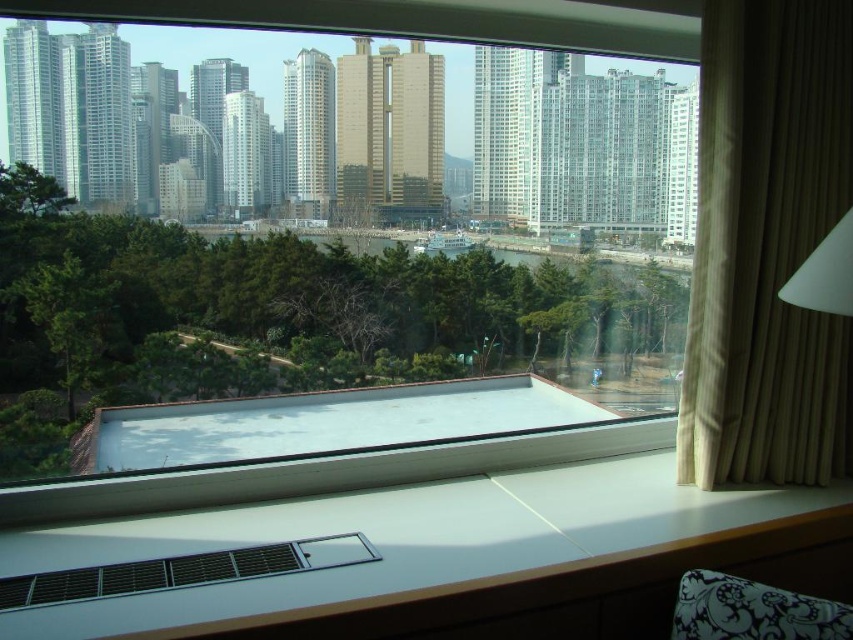
You are standing inside the room and want to look out through the transparent glass window at center. Where should you position yourself to see the entire cityscape outside?

Position yourself at the center of the room to ensure you can see the entire cityscape through the transparent glass window at center located at point coordinates (318,224).

You are standing inside the room and want to look outside through the transparent glass window at center. However, the matte plastic vent at lower center is blocking your view. Can you see the cityscape through the window without moving the vent?

The transparent glass window at center is bigger than the matte plastic vent at lower center, so yes, you can still see the cityscape through the transparent glass window at center as it is larger and not fully obstructed by the vent.

You are standing in the room looking out the window. You notice a matte plastic vent at lower center and a white matte lampshade at upper right. Which object is positioned to the left of the other?

The matte plastic vent at lower center is to the left of the white matte lampshade at upper right.